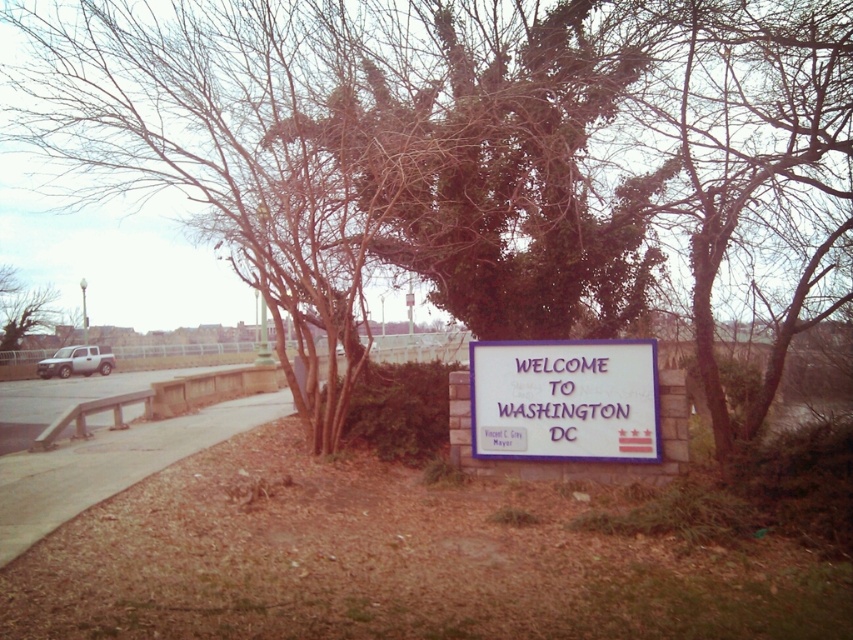
Which of these two, brown concrete sidewalk at lower left or green leafy tree at left, stands taller?

Standing taller between the two is green leafy tree at left.

Can you confirm if brown concrete sidewalk at lower left is positioned to the right of green leafy tree at left?

Correct, you'll find brown concrete sidewalk at lower left to the right of green leafy tree at left.

Is point (21, 497) positioned in front of point (32, 310)?

Yes, point (21, 497) is in front of point (32, 310).

At what (x,y) coordinates should I click in order to perform the action: click on brown concrete sidewalk at lower left. Please return your answer as a coordinate pair (x, y). Looking at the image, I should click on (111, 465).

Is white matte sign at center further to the viewer compared to green leafy tree at left?

That is False.

Describe the element at coordinates (566, 400) in the screenshot. The image size is (853, 640). I see `white matte sign at center` at that location.

Which is in front, point (643, 364) or point (0, 278)?

Point (643, 364) is more forward.

The height and width of the screenshot is (640, 853). What are the coordinates of `white matte sign at center` in the screenshot? It's located at (566, 400).

Which of these two, white matte sign at center or brown concrete sidewalk at lower left, stands taller?

With more height is white matte sign at center.

Where is `white matte sign at center`? white matte sign at center is located at coordinates (566, 400).

The image size is (853, 640). Identify the location of white matte sign at center. (566, 400).